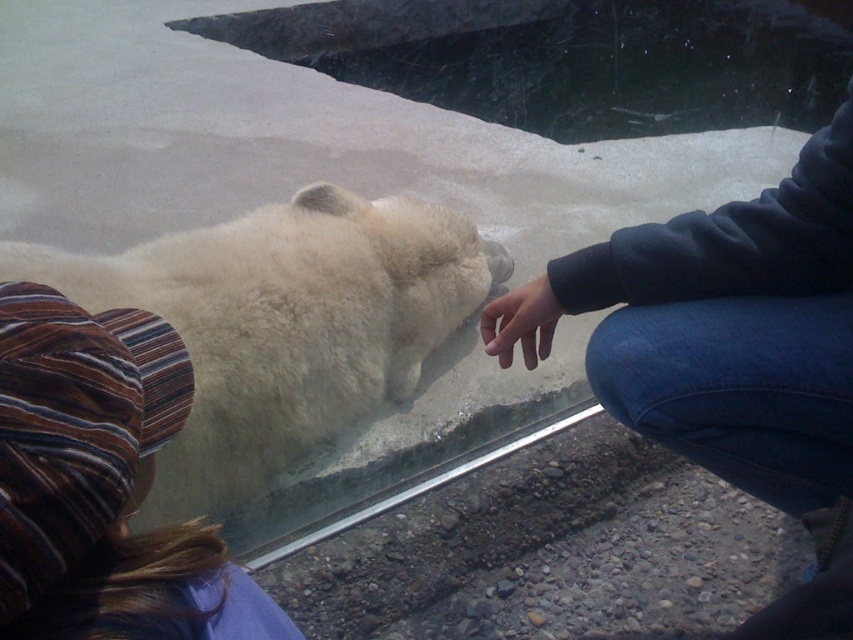
Question: Which point is farther to the camera?

Choices:
 (A) striped fabric hat at upper left
 (B) dark blue sweatshirt at upper right

Answer: (B)

Question: Can you confirm if dark blue sweatshirt at upper right is positioned below matte black hand at center?

Choices:
 (A) no
 (B) yes

Answer: (B)

Question: Observing the image, what is the correct spatial positioning of dark blue sweatshirt at upper right in reference to matte black hand at center?

Choices:
 (A) left
 (B) right

Answer: (B)

Question: Can you confirm if dark blue sweatshirt at upper right is positioned to the right of striped fabric hat at upper left?

Choices:
 (A) yes
 (B) no

Answer: (A)

Question: Which of these objects is positioned closest to the white fluffy polar bear at center?

Choices:
 (A) striped fabric hat at upper left
 (B) dark blue sweatshirt at upper right

Answer: (B)

Question: Which object appears closest to the camera in this image?

Choices:
 (A) striped fabric hat at upper left
 (B) dark blue sweatshirt at upper right
 (C) white fluffy polar bear at center
 (D) matte black hand at center

Answer: (A)